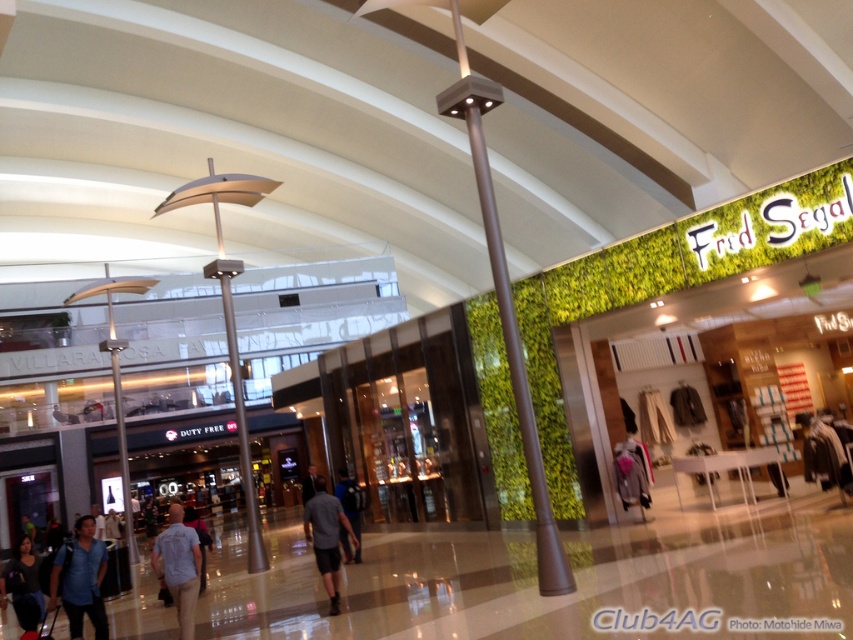
You are a customer in the mall and want to place your dark gray fabric bag at lower left on top of the gray fabric shorts at center. Will the bag fit on top of the shorts?

The gray fabric shorts at center has a lesser height compared to dark gray fabric bag at lower left, so the bag will not fit on top of the shorts since it is taller than the shorts.

You are a customer standing in the mall and you see the satin silver pole at center and the dark blue shirt at center. Which object is shorter?

The satin silver pole at center is shorter than the dark blue shirt at center.